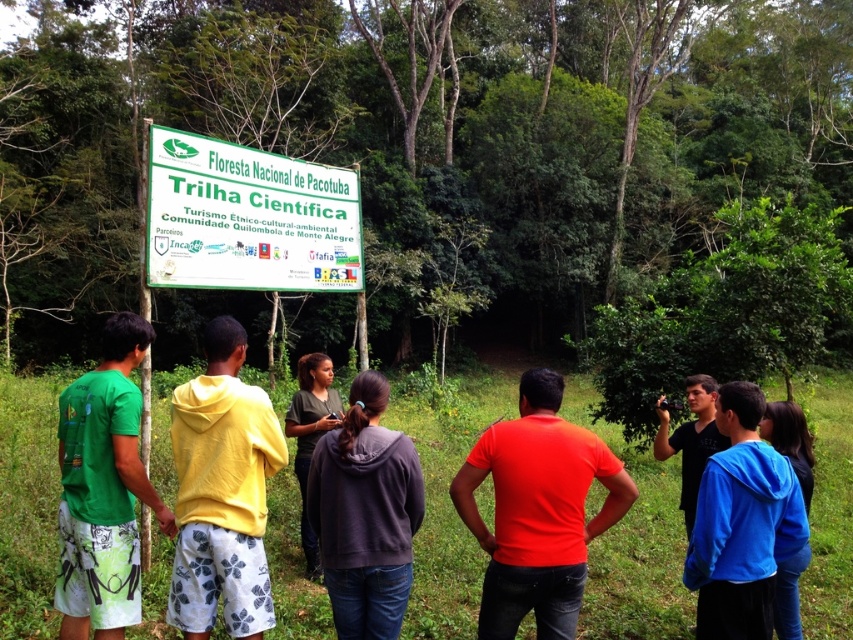
You are a hiker who wants to read the signboard but is currently standing 3 meters away from the green plastic sign at center and the dark gray fabric shirt at center. Considering the size difference between them, which one do you think is easier to read from your current position?

The green plastic sign at center is wider than the dark gray fabric shirt at center, so it should be easier to read from 3 meters away.